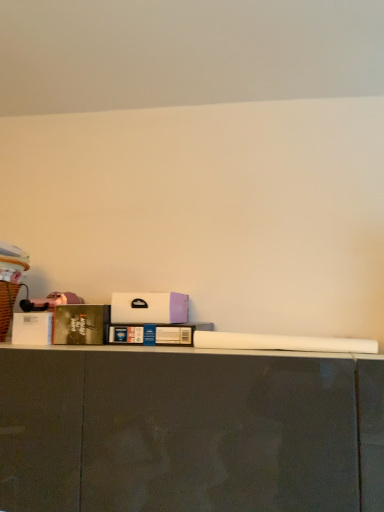
Question: From the image's perspective, is hardcover book at left, the 2th book in the right-to-left sequence, under white matte box at center?

Choices:
 (A) yes
 (B) no

Answer: (A)

Question: From a real-world perspective, is hardcover book at left, the 1th book in the left-to-right sequence, on white matte box at center?

Choices:
 (A) no
 (B) yes

Answer: (A)

Question: Can you confirm if hardcover book at left, the 2th book in the right-to-left sequence, is bigger than white matte box at center?

Choices:
 (A) no
 (B) yes

Answer: (A)

Question: Is hardcover book at left, the 1th book in the left-to-right sequence, touching white matte box at center?

Choices:
 (A) no
 (B) yes

Answer: (A)

Question: Is hardcover book at left, the 2th book in the right-to-left sequence, wider than white matte box at center?

Choices:
 (A) no
 (B) yes

Answer: (A)

Question: Does hardcover book at left, the 1th book in the left-to-right sequence, have a lesser width compared to white matte box at center?

Choices:
 (A) yes
 (B) no

Answer: (A)

Question: Is blue cardboard book at center, which appears as the 1th book when viewed from the right, shorter than brown wicker laundry basket at left?

Choices:
 (A) yes
 (B) no

Answer: (A)

Question: Can you confirm if blue cardboard book at center, which is counted as the second book, starting from the left, is bigger than brown wicker laundry basket at left?

Choices:
 (A) yes
 (B) no

Answer: (B)

Question: Does blue cardboard book at center, which appears as the 1th book when viewed from the right, touch brown wicker laundry basket at left?

Choices:
 (A) no
 (B) yes

Answer: (A)

Question: Does blue cardboard book at center, which is counted as the second book, starting from the left, have a greater width compared to brown wicker laundry basket at left?

Choices:
 (A) no
 (B) yes

Answer: (B)

Question: Can you confirm if blue cardboard book at center, which appears as the 1th book when viewed from the right, is thinner than brown wicker laundry basket at left?

Choices:
 (A) yes
 (B) no

Answer: (B)

Question: Is blue cardboard book at center, which appears as the 1th book when viewed from the right, aimed at brown wicker laundry basket at left?

Choices:
 (A) no
 (B) yes

Answer: (A)

Question: Could you tell me if blue cardboard book at center, which appears as the 1th book when viewed from the right, is turned towards hardcover book at left, the 2th book in the right-to-left sequence?

Choices:
 (A) no
 (B) yes

Answer: (A)